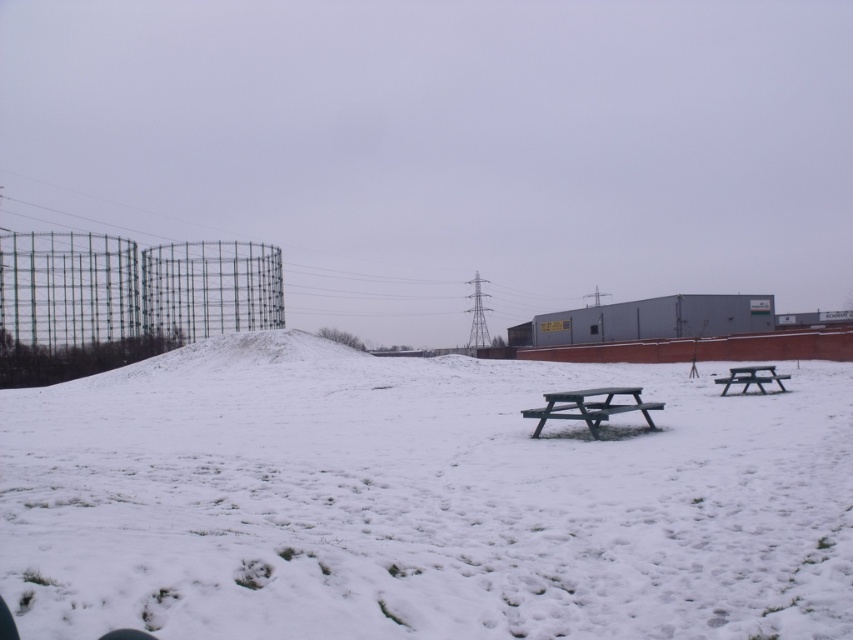
Does white powdery snow at center appear under green plastic picnic table at center?

Incorrect, white powdery snow at center is not positioned below green plastic picnic table at center.

Is white powdery snow at center positioned at the back of green plastic picnic table at center?

No, white powdery snow at center is closer to the viewer.

Where is `white powdery snow at center`? white powdery snow at center is located at coordinates (421, 499).

Where is `white powdery snow at center`? The image size is (853, 640). white powdery snow at center is located at coordinates (421, 499).

Does green plastic picnic table at center have a lesser width compared to wooden picnic table at right?

Indeed, green plastic picnic table at center has a lesser width compared to wooden picnic table at right.

Does green plastic picnic table at center have a greater width compared to wooden picnic table at right?

In fact, green plastic picnic table at center might be narrower than wooden picnic table at right.

Describe the element at coordinates (589, 406) in the screenshot. I see `green plastic picnic table at center` at that location.

The image size is (853, 640). I want to click on green plastic picnic table at center, so click(x=589, y=406).

At what (x,y) coordinates should I click in order to perform the action: click on white powdery snow at center. Please return your answer as a coordinate pair (x, y). This screenshot has width=853, height=640. Looking at the image, I should click on [x=421, y=499].

Who is shorter, white powdery snow at center or wooden picnic table at right?

Standing shorter between the two is wooden picnic table at right.

I want to click on white powdery snow at center, so click(x=421, y=499).